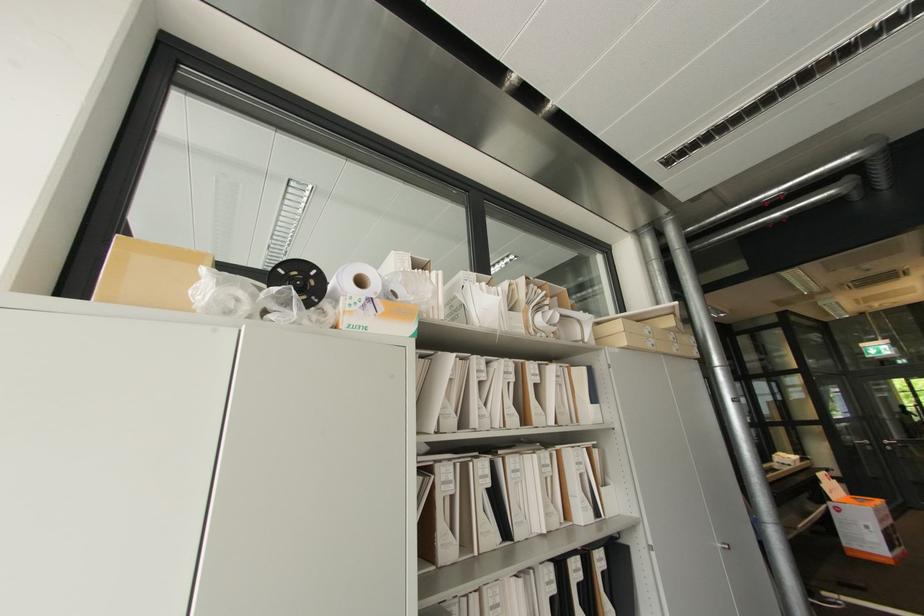
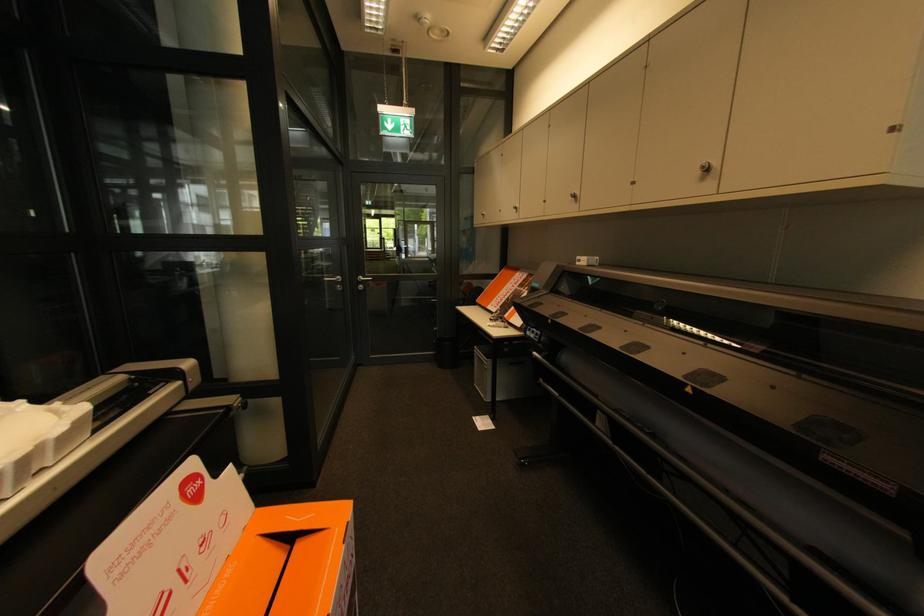
In the second image, find the point that corresponds to point (893, 448) in the first image.

(365, 286)